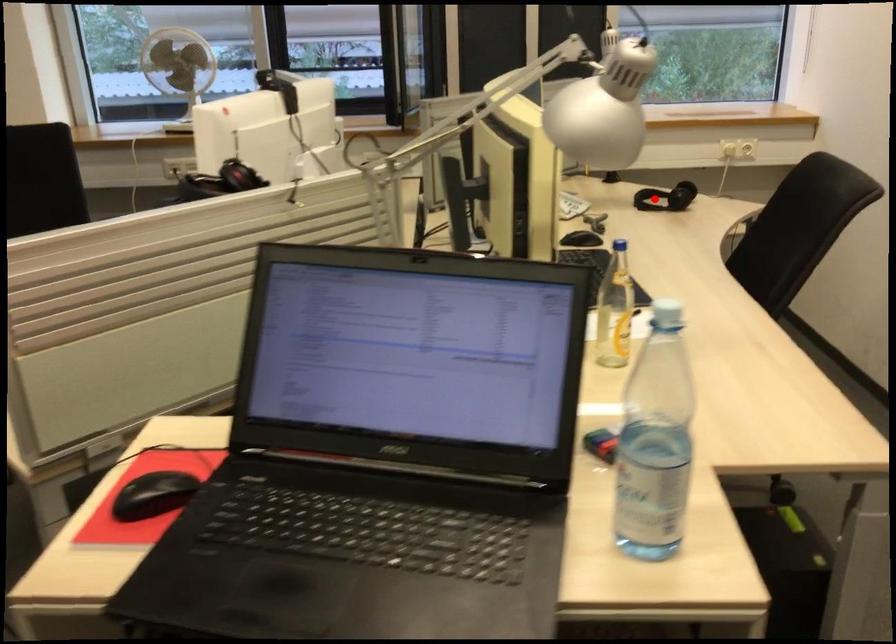
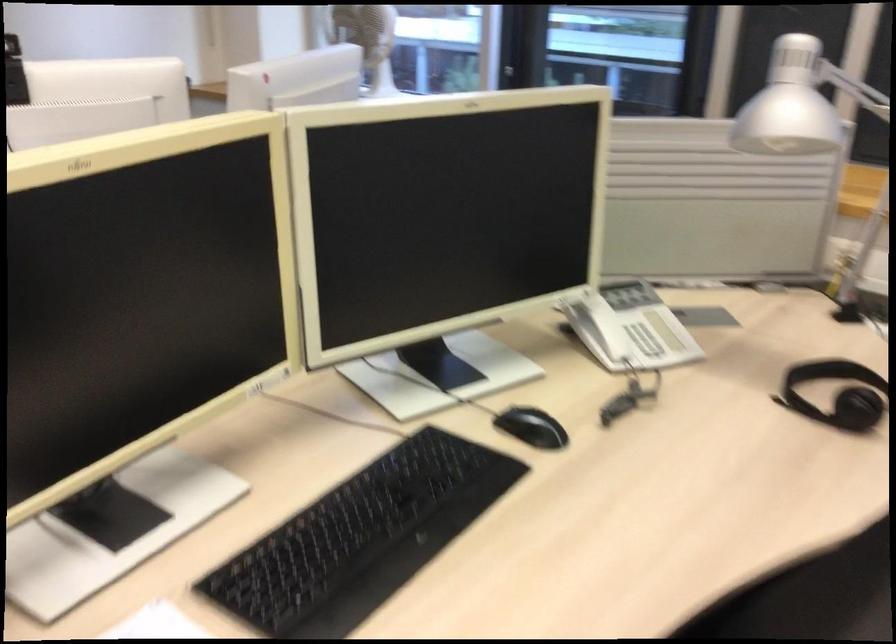
Question: I am providing you with two images of the same scene from different viewpoints. A red point is marked on the first image. Is the red point's position out of view in image 2?

Choices:
 (A) Yes
 (B) No

Answer: (B)